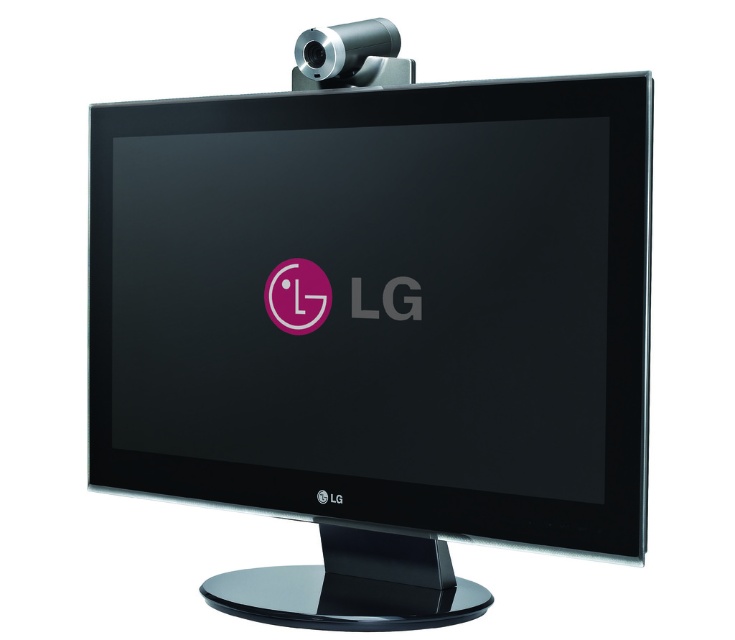
Question: Does black glossy monitor at center appear under silver metallic webcam at top?

Choices:
 (A) no
 (B) yes

Answer: (B)

Question: From the image, what is the correct spatial relationship of black glossy monitor at center in relation to silver metallic webcam at top?

Choices:
 (A) below
 (B) above

Answer: (A)

Question: Can you confirm if black glossy monitor at center is thinner than silver metallic webcam at top?

Choices:
 (A) no
 (B) yes

Answer: (A)

Question: Which of the following is the farthest from the observer?

Choices:
 (A) silver metallic webcam at top
 (B) black glossy monitor at center

Answer: (A)

Question: Among these objects, which one is farthest from the camera?

Choices:
 (A) black glossy monitor at center
 (B) silver metallic webcam at top

Answer: (B)

Question: Which object is closer to the camera taking this photo?

Choices:
 (A) black glossy monitor at center
 (B) silver metallic webcam at top

Answer: (A)